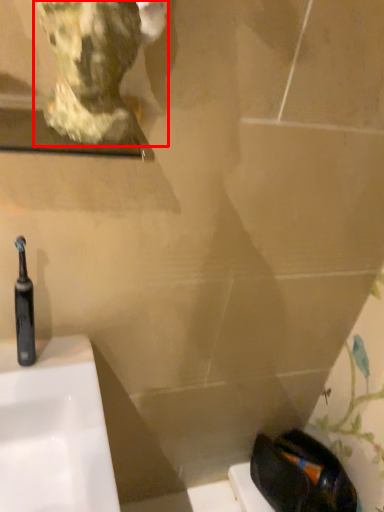
Question: From the image's perspective, where is sculpture (annotated by the red box) located relative to toothbrush?

Choices:
 (A) above
 (B) below

Answer: (A)